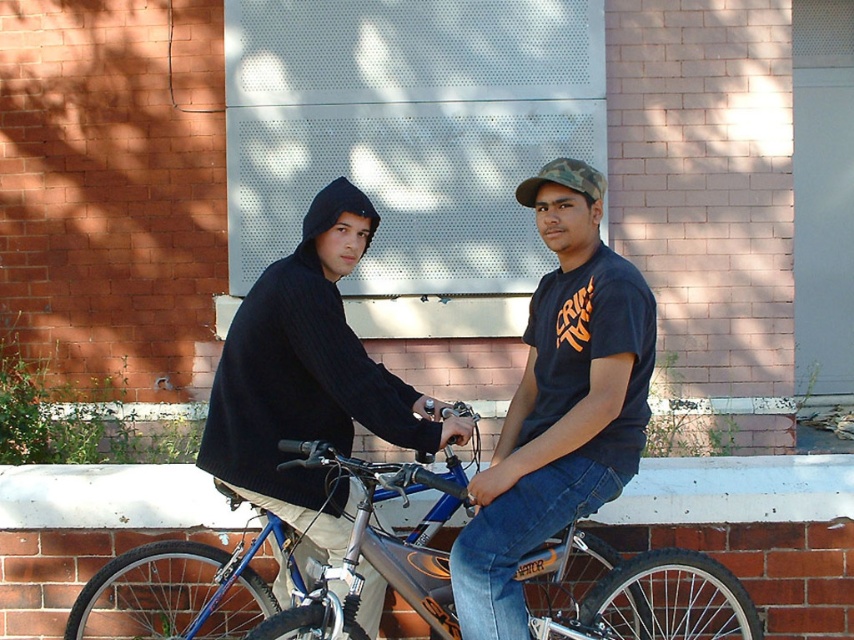
Question: Estimate the real-world distances between objects in this image. Which object is closer to the blue metallic bicycle at center?

Choices:
 (A) white painted brick ledge at lower center
 (B) matte black t-shirt at center
 (C) dark blue knit hoodie at left

Answer: (C)

Question: Is blue metallic bicycle at center to the right of white painted brick ledge at lower center from the viewer's perspective?

Choices:
 (A) yes
 (B) no

Answer: (A)

Question: Among these points, which one is farthest from the camera?

Choices:
 (A) (218, 513)
 (B) (405, 483)
 (C) (290, 424)
 (D) (616, 404)

Answer: (A)

Question: Which object is the farthest from the blue metallic bicycle at center?

Choices:
 (A) dark blue knit hoodie at left
 (B) matte black t-shirt at center
 (C) white painted brick ledge at lower center

Answer: (C)

Question: Where is blue metallic bicycle at center located in relation to white painted brick ledge at lower center in the image?

Choices:
 (A) below
 (B) above

Answer: (A)

Question: Can you confirm if blue metallic bicycle at center is positioned above dark blue knit hoodie at left?

Choices:
 (A) no
 (B) yes

Answer: (A)